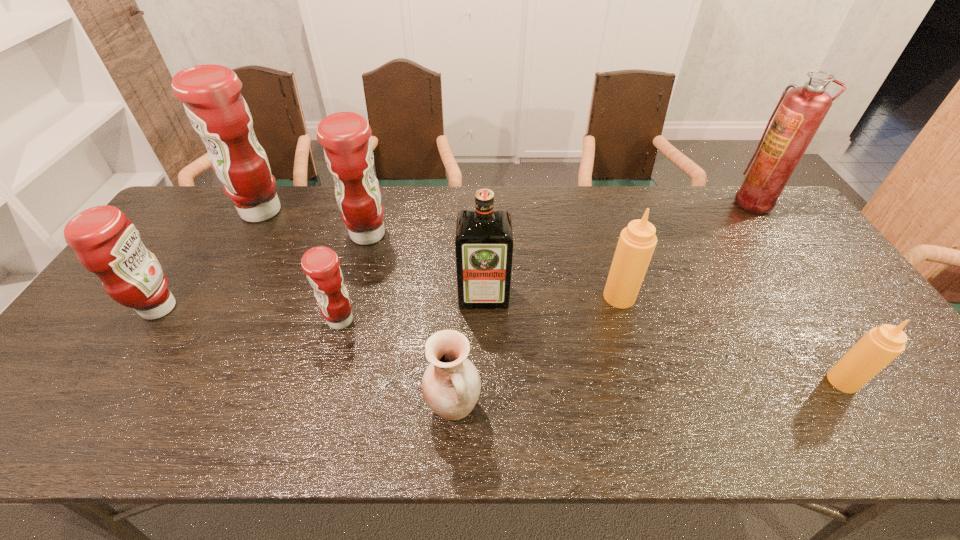
This screenshot has height=540, width=960. I want to click on pottery, so click(451, 384).

Identify the location of blank space located 0.090m on the front of the tallest condiment. (239, 250).

The width and height of the screenshot is (960, 540). Find the location of `free space located on the side of the fire extinguisher with the label`. free space located on the side of the fire extinguisher with the label is located at coordinates coord(681,202).

Identify the location of free space located 0.280m on the side of the fire extinguisher with the label. The width and height of the screenshot is (960, 540). (652, 202).

Where is `free space located on the side of the fire extinguisher with the label`? free space located on the side of the fire extinguisher with the label is located at coordinates (705, 202).

I want to click on free space located 0.070m on the front of the second tallest condiment, so click(358, 272).

At what (x,y) coordinates should I click in order to perform the action: click on vacant area situated on the front label of the liquor. Please return your answer as a coordinate pair (x, y). This screenshot has width=960, height=540. Looking at the image, I should click on (484, 347).

The height and width of the screenshot is (540, 960). Identify the location of vacant space located on the front of the third biggest red condiment. (109, 383).

Find the location of `vacant space located on the right of the farther tan condiment`. vacant space located on the right of the farther tan condiment is located at coordinates (679, 296).

This screenshot has height=540, width=960. I want to click on vacant area situated 0.150m on the left of the rightmost condiment, so click(x=764, y=381).